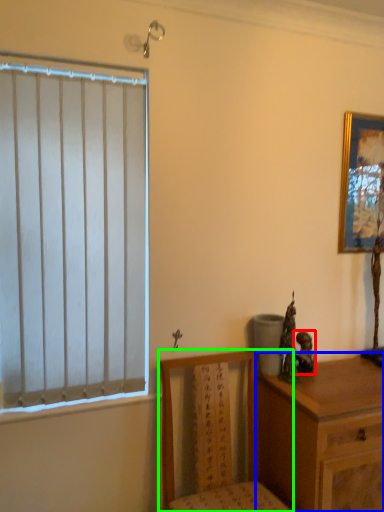
Question: Considering the real-world distances, which object is farthest from figurine (highlighted by a red box)? chest of drawers (highlighted by a blue box) or chair (highlighted by a green box)?

Choices:
 (A) chest of drawers
 (B) chair

Answer: (B)